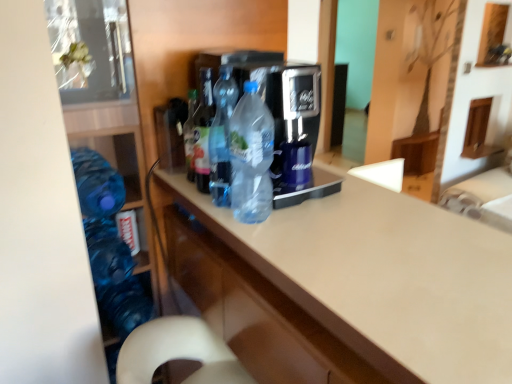
Question: In the image, is translucent plastic bottle at center, which appears as the 4th bottle when viewed from the left, on the left side or the right side of blue translucent bottle at lower left, which appears as the fourth bottle when viewed from the right?

Choices:
 (A) left
 (B) right

Answer: (B)

Question: In terms of width, does translucent plastic bottle at center, placed as the first bottle when sorted from right to left, look wider or thinner when compared to blue translucent bottle at lower left, which appears as the fourth bottle when viewed from the right?

Choices:
 (A) thin
 (B) wide

Answer: (A)

Question: Which object is positioned farthest from the translucent plastic bottle at center, the 2th bottle viewed from the right?

Choices:
 (A) transparent plastic bottles at center
 (B) beige laminate countertop at center
 (C) translucent plastic bottle at center, which appears as the 4th bottle when viewed from the left
 (D) blue translucent bottle at lower left, which appears as the fourth bottle when viewed from the right
 (E) translucent plastic bottle at center, arranged as the third bottle when viewed from the right

Answer: (D)

Question: Estimate the real-world distances between objects in this image. Which object is farther from the translucent plastic bottle at center, the third bottle when ordered from left to right?

Choices:
 (A) translucent plastic bottle at center, which appears as the 4th bottle when viewed from the left
 (B) blue translucent bottle at lower left, which appears as the fourth bottle when viewed from the right
 (C) translucent plastic bottle at center, the 2th bottle when ordered from left to right
 (D) transparent plastic bottles at center
 (E) beige laminate countertop at center

Answer: (B)